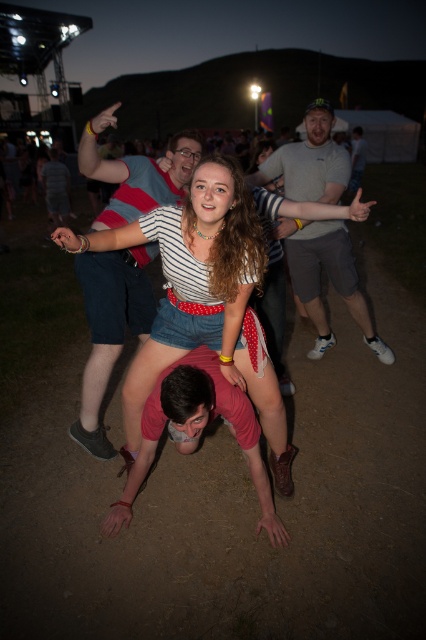
Question: Can you confirm if white striped shirt at center is positioned below gray fabric shirt at center?

Choices:
 (A) no
 (B) yes

Answer: (B)

Question: Which of the following is the closest to the observer?

Choices:
 (A) (x=123, y=157)
 (B) (x=302, y=273)

Answer: (A)

Question: Which of the following is the farthest from the observer?

Choices:
 (A) (126, 417)
 (B) (131, 157)

Answer: (B)

Question: Is white striped shirt at center positioned at the back of striped t-shirt at center?

Choices:
 (A) yes
 (B) no

Answer: (A)

Question: Which of the following is the closest to the observer?

Choices:
 (A) (339, 179)
 (B) (178, 177)
 (C) (166, 237)

Answer: (C)

Question: Where is white striped shirt at center located in relation to striped t-shirt at center in the image?

Choices:
 (A) above
 (B) below

Answer: (B)